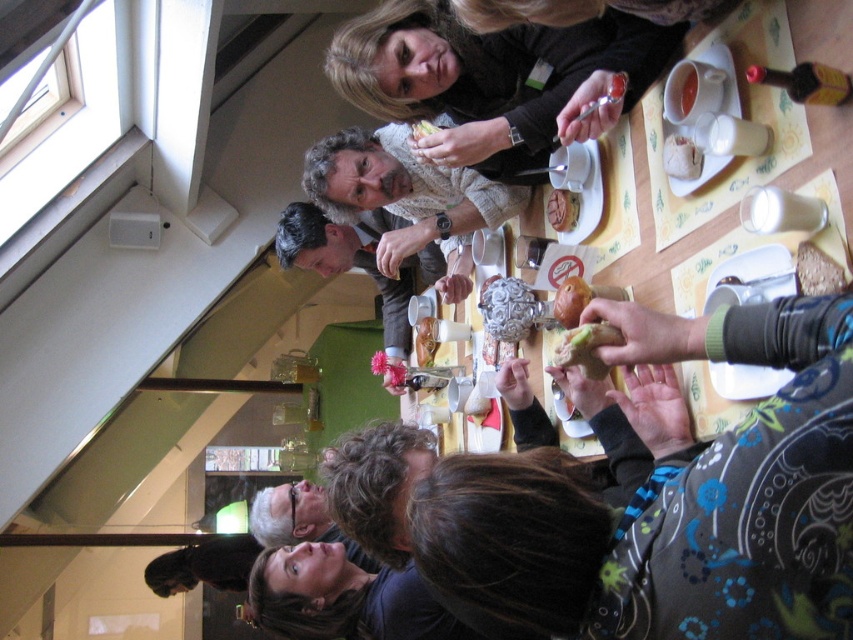
In the scene shown: You are a server at the communal dining area. You need to place a new dish that is 10 inches wide on the wooden table at center. The dish must be placed where there is enough space. Considering the crusty bread at center is already on the table, can the dish fit next to it?

The wooden table at center is wider than the crusty bread at center. Since the table is wider, there should be enough space next to the crusty bread at center to place the 10 inch wide dish.

You are standing at the edge of the table and want to place a new plate at the exact center of the table. Considering the position of the matte black sweater at upper center, which is located at coordinate point 0.120 on the x and 0.572 on the y axis, can you determine how far you need to move from the sweater to reach the center of the table?

The center of the table is at coordinate point 0.5 on both the x and y axes. The matte black sweater at upper center is at point 0.120 on the x and 0.572 on the y axis. To reach the center, you need to move 0.380 units in the positive x direction and 0.028 units in the negative y direction.